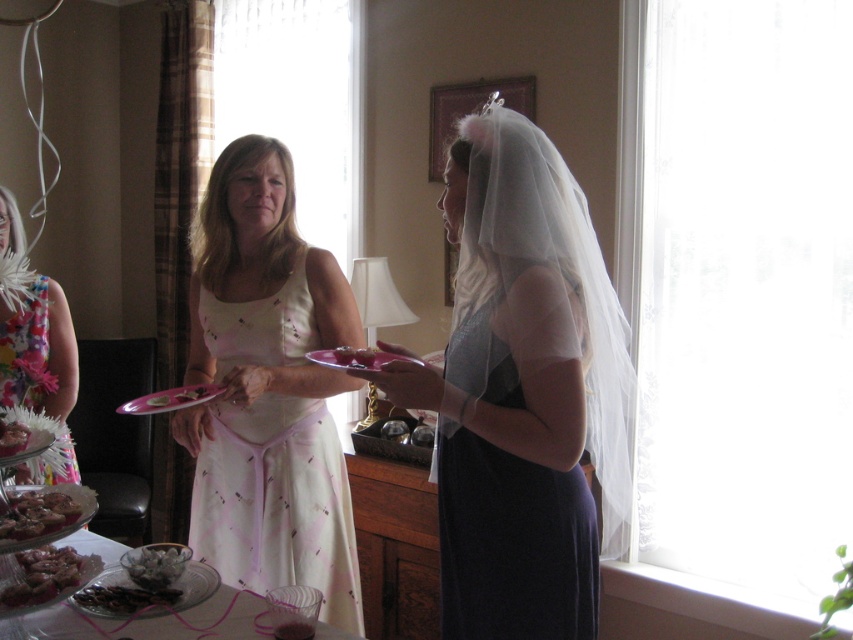
Question: Does chocolate glazed cookies at lower left come behind pink plastic plate at center?

Choices:
 (A) no
 (B) yes

Answer: (A)

Question: Among these points, which one is farthest from the camera?

Choices:
 (A) (161, 605)
 (B) (154, 392)

Answer: (B)

Question: From the image, what is the correct spatial relationship of silky white veil at center in relation to dark blue satin dress at center?

Choices:
 (A) right
 (B) left

Answer: (A)

Question: Which object is positioned closest to the pink plastic plate at center?

Choices:
 (A) shiny silver cookie at lower left
 (B) shiny silver platter at lower left
 (C) translucent glass bowl at lower left
 (D) pink glossy plate at center

Answer: (D)

Question: Is dark blue satin dress at center wider than chocolate-covered nuts at lower left?

Choices:
 (A) yes
 (B) no

Answer: (A)

Question: Which object appears farthest from the camera in this image?

Choices:
 (A) pink plastic plate at center
 (B) dark blue satin dress at center
 (C) shiny silver cookie at lower left
 (D) pink glossy plate at center

Answer: (D)